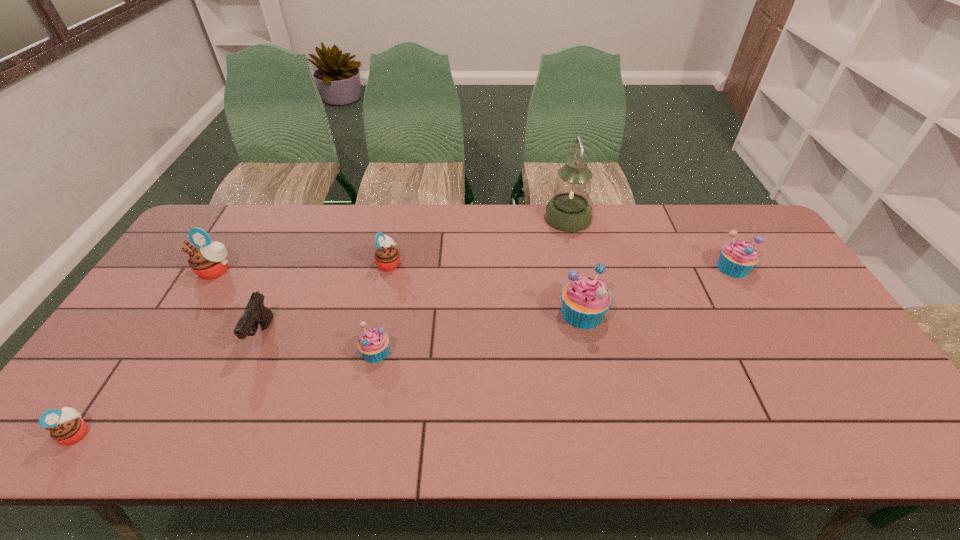
At what (x,y) coordinates should I click in order to perform the action: click on pistol. Please return your answer as a coordinate pair (x, y). The width and height of the screenshot is (960, 540). Looking at the image, I should click on (255, 313).

Find the location of a particular element. The height and width of the screenshot is (540, 960). the second nearest muffin is located at coordinates (373, 344).

This screenshot has height=540, width=960. I want to click on the nearest blue muffin, so click(x=373, y=344).

Locate an element on the screen. Image resolution: width=960 pixels, height=540 pixels. the leftmost muffin is located at coordinates (66, 427).

You are a GUI agent. You are given a task and a screenshot of the screen. Output one action in this format:
    pyautogui.click(x=<x>, y=<y>)
    Task: Click on the leftmost pink muffin
    Image resolution: width=960 pixels, height=540 pixels.
    Given the screenshot: What is the action you would take?
    pyautogui.click(x=66, y=427)

This screenshot has height=540, width=960. In order to click on vacant space located on the front of the farthest object in this screenshot , I will do `click(579, 267)`.

Where is `free space located 0.060m on the back of the second blue muffin from left to right`? free space located 0.060m on the back of the second blue muffin from left to right is located at coordinates (575, 280).

At what (x,y) coordinates should I click in order to perform the action: click on vacant area located on the front-facing side of the biggest pink muffin. Please return your answer as a coordinate pair (x, y). Looking at the image, I should click on (185, 321).

Identify the location of free spot located on the front-facing side of the second biggest pink muffin. The image size is (960, 540). (430, 263).

This screenshot has height=540, width=960. Identify the location of vacant region located on the front of the rightmost muffin. (763, 318).